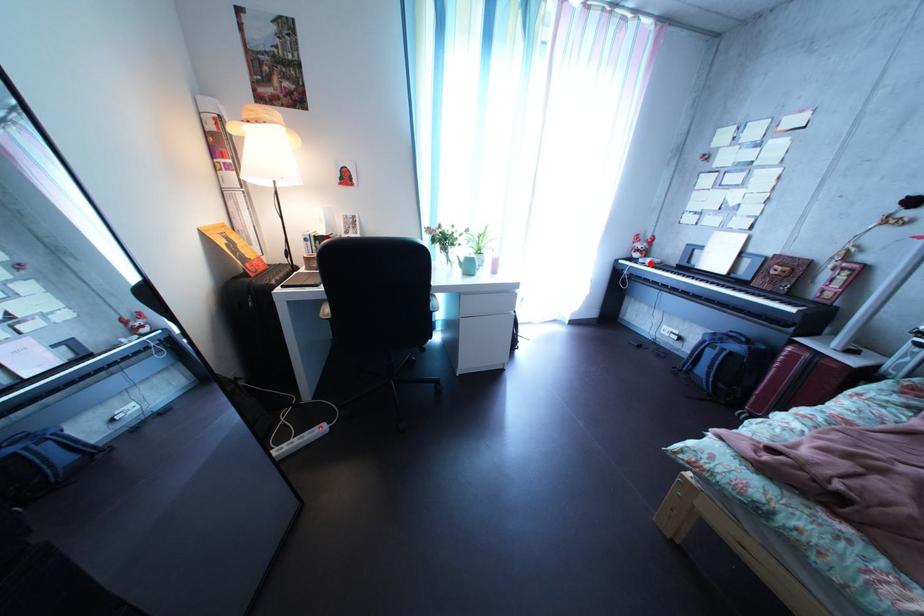
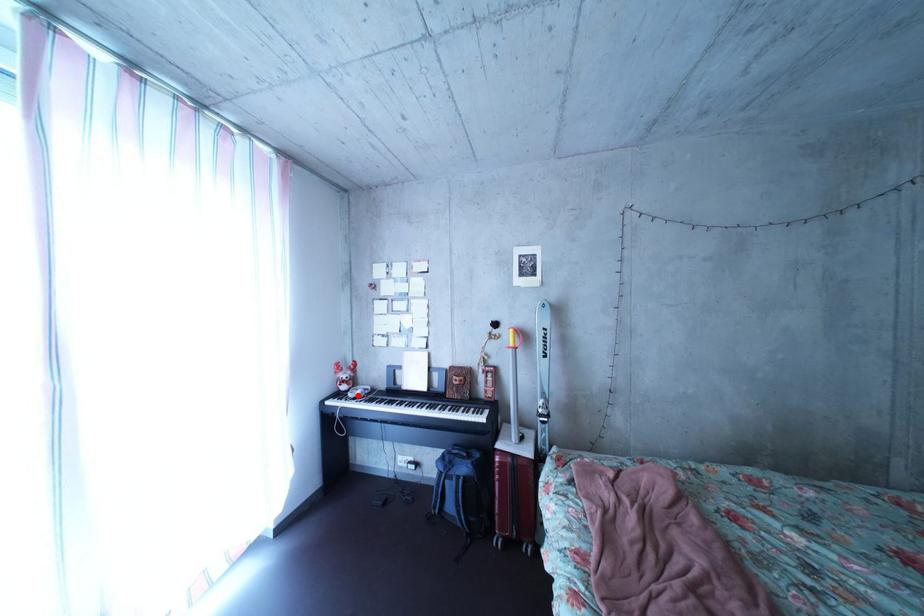
I am providing you with two images of the same scene from different viewpoints. A red point is marked on the first image and another point is marked on the second image. Does the point marked in image1 correspond to the same location as the one in image2?

Yes